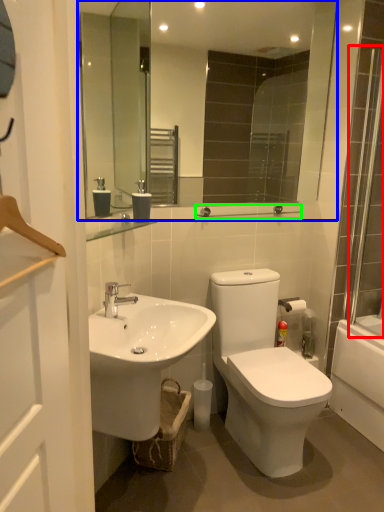
Question: Which is farther away from shower door (highlighted by a red box)? mirror (highlighted by a blue box) or balustrade (highlighted by a green box)?

Choices:
 (A) mirror
 (B) balustrade

Answer: (A)